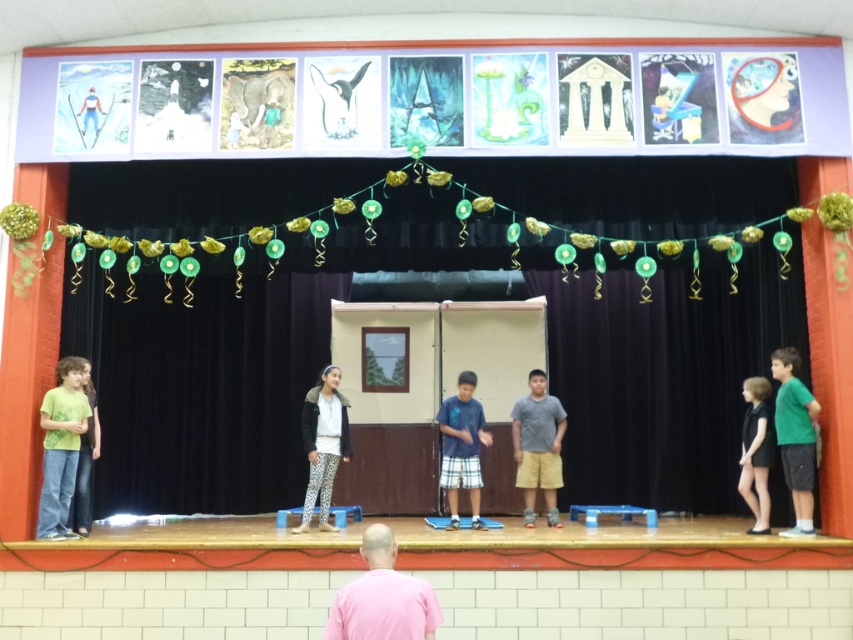
Who is taller, blue cotton shirt at center or green matte pants at left?

green matte pants at left is taller.

Measure the distance between blue cotton shirt at center and green matte pants at left.

They are 2.96 meters apart.

Which is in front, point (456, 508) or point (80, 451)?

Point (80, 451) is more forward.

This screenshot has height=640, width=853. What are the coordinates of `blue cotton shirt at center` in the screenshot? It's located at (462, 448).

Does black dress at right have a larger size compared to green matte pants at left?

Indeed, black dress at right has a larger size compared to green matte pants at left.

Who is more forward, (747, 497) or (80, 536)?

Point (80, 536) is in front.

Measure the distance between black dress at right and camera.

black dress at right is 27.29 feet from camera.

Identify the location of black dress at right. (756, 451).

Does green matte shirt at left appear on the left side of green matte shirt at right?

Yes, green matte shirt at left is to the left of green matte shirt at right.

Between green matte shirt at left and green matte shirt at right, which one has less height?

Standing shorter between the two is green matte shirt at left.

This screenshot has width=853, height=640. Find the location of `green matte shirt at left`. green matte shirt at left is located at coordinates (61, 445).